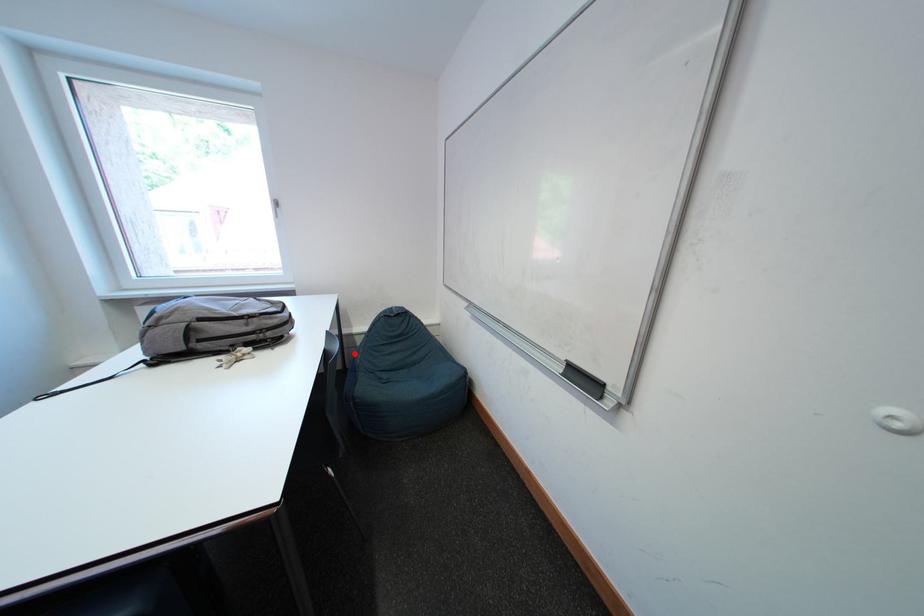
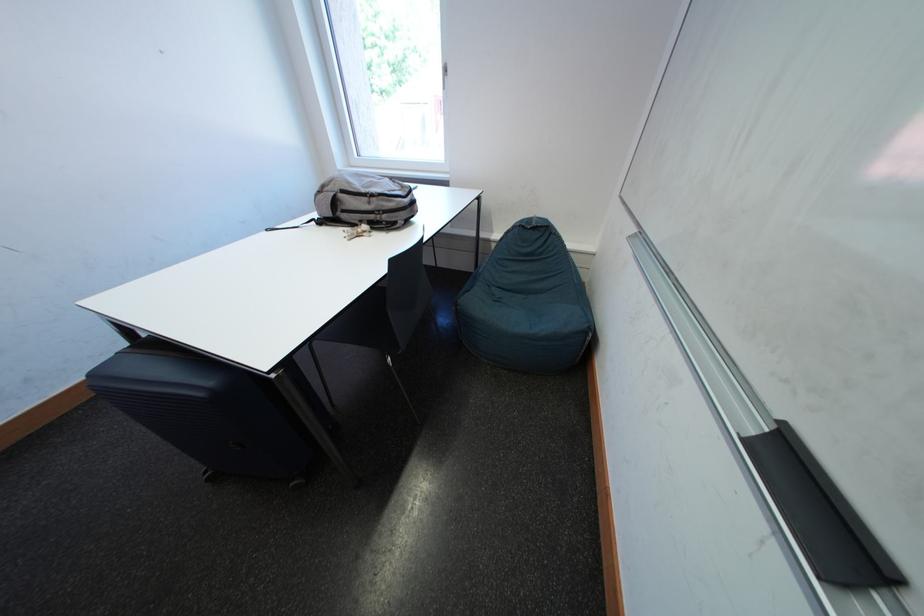
Question: I am providing you with two images of the same scene from different viewpoints. A red point is shown in image1. For the corresponding object point in image2, is it positioned nearer or farther from the camera?

Choices:
 (A) Nearer
 (B) Farther

Answer: (A)